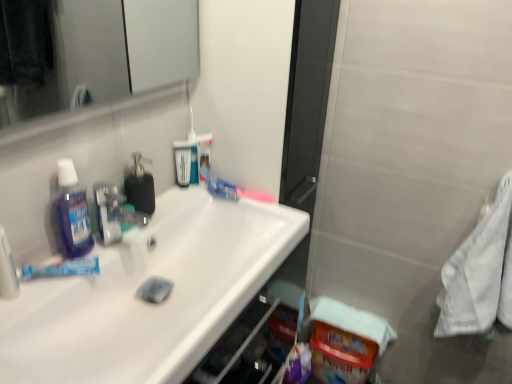
The width and height of the screenshot is (512, 384). What are the coordinates of `free space that is in between translucent plastic toothbrush at upper center, placed as the second toothbrush when sorted from right to left, and black rubber soap dispenser at center` in the screenshot? It's located at (170, 200).